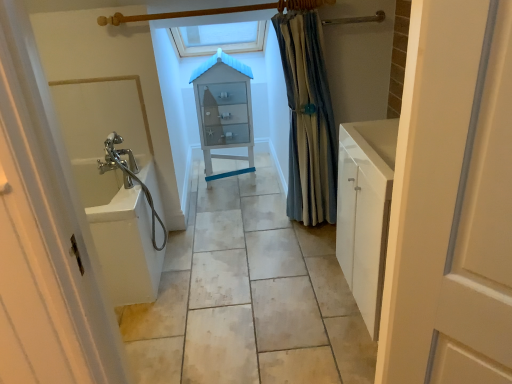
Locate an element on the screen. Image resolution: width=512 pixels, height=384 pixels. free space in front of translucent glass cabinet at center is located at coordinates (230, 208).